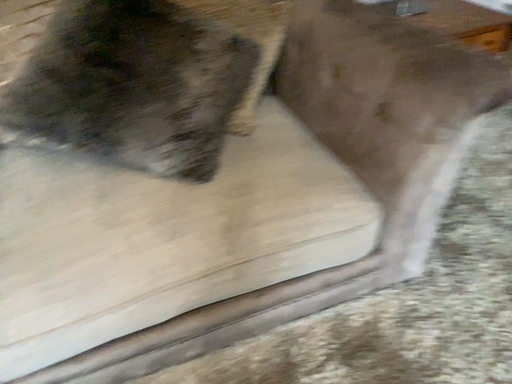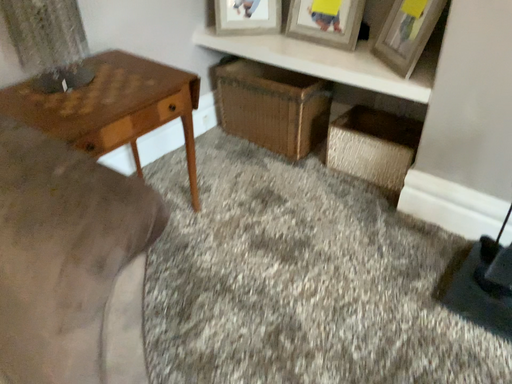
Question: Which way did the camera rotate in the video?

Choices:
 (A) rotated right
 (B) rotated left

Answer: (A)